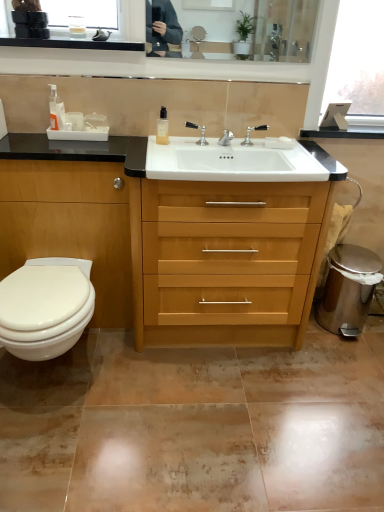
This screenshot has height=512, width=384. Find the location of `polished silver faucet at center`. polished silver faucet at center is located at coordinates (201, 132).

This screenshot has height=512, width=384. What do you see at coordinates (226, 261) in the screenshot? I see `light wood/finish chest of drawers at center` at bounding box center [226, 261].

Where is `clear glass bottle at center, placed as the second toiletry when sorted from left to right`? This screenshot has height=512, width=384. clear glass bottle at center, placed as the second toiletry when sorted from left to right is located at coordinates (162, 127).

How many degrees apart are the facing directions of white glossy toilet at lower left and light wood/finish chest of drawers at center?

The facing directions of white glossy toilet at lower left and light wood/finish chest of drawers at center are 0.343 degrees apart.

From the image's perspective, is white glossy toilet at lower left above or below light wood/finish chest of drawers at center?

Clearly, from the image's perspective, white glossy toilet at lower left is below light wood/finish chest of drawers at center.

Which of these two, white glossy toilet at lower left or light wood/finish chest of drawers at center, is bigger?

light wood/finish chest of drawers at center is bigger.

Find the location of a particular element. The height and width of the screenshot is (512, 384). the chest of drawers behind the white glossy toilet at lower left is located at coordinates (226, 261).

Is translucent plastic bottle at upper left, marked as the first toiletry in a left-to-right arrangement, bigger than polished chrome faucet at center?

Correct, translucent plastic bottle at upper left, marked as the first toiletry in a left-to-right arrangement, is larger in size than polished chrome faucet at center.

From the image's perspective, does translucent plastic bottle at upper left, marked as the first toiletry in a left-to-right arrangement, appear higher than polished chrome faucet at center?

Correct, translucent plastic bottle at upper left, marked as the first toiletry in a left-to-right arrangement, appears higher than polished chrome faucet at center in the image.

Based on the photo, considering the positions of objects translucent plastic bottle at upper left, acting as the second toiletry starting from the right, and polished chrome faucet at center in the image provided, who is more to the left, translucent plastic bottle at upper left, acting as the second toiletry starting from the right, or polished chrome faucet at center?

Positioned to the left is translucent plastic bottle at upper left, acting as the second toiletry starting from the right.

From a real-world perspective, which is physically below, translucent plastic bottle at upper left, marked as the first toiletry in a left-to-right arrangement, or polished chrome faucet at center?

In real-world perspective, polished chrome faucet at center is lower.

Consider the image. Which object is positioned more to the right, polished silver faucet at center or translucent plastic bottle at upper left, acting as the second toiletry starting from the right?

polished silver faucet at center.

The width and height of the screenshot is (384, 512). I want to click on faucet to the right of translucent plastic bottle at upper left, marked as the first toiletry in a left-to-right arrangement, so click(x=201, y=132).

Who is smaller, polished silver faucet at center or translucent plastic bottle at upper left, marked as the first toiletry in a left-to-right arrangement?

polished silver faucet at center.

From a real-world perspective, does polished silver faucet at center sit lower than translucent plastic bottle at upper left, marked as the first toiletry in a left-to-right arrangement?

Indeed, from a real-world perspective, polished silver faucet at center is positioned beneath translucent plastic bottle at upper left, marked as the first toiletry in a left-to-right arrangement.

Is polished silver faucet at center outside of clear glass bottle at center, positioned as the 1th toiletry in right-to-left order?

Absolutely, polished silver faucet at center is external to clear glass bottle at center, positioned as the 1th toiletry in right-to-left order.

Is polished silver faucet at center positioned with its back to clear glass bottle at center, positioned as the 1th toiletry in right-to-left order?

polished silver faucet at center does not have its back to clear glass bottle at center, positioned as the 1th toiletry in right-to-left order.

Consider the image. From a real-world perspective, between polished silver faucet at center and clear glass bottle at center, positioned as the 1th toiletry in right-to-left order, who is vertically higher?

From a 3D spatial view, clear glass bottle at center, positioned as the 1th toiletry in right-to-left order, is above.

Does polished silver faucet at center appear on the right side of clear glass bottle at center, placed as the second toiletry when sorted from left to right?

Yes, polished silver faucet at center is to the right of clear glass bottle at center, placed as the second toiletry when sorted from left to right.

Is polished silver faucet at center wider than light wood/finish chest of drawers at center?

Incorrect, the width of polished silver faucet at center does not surpass that of light wood/finish chest of drawers at center.

From the image's perspective, which is above, polished silver faucet at center or light wood/finish chest of drawers at center?

polished silver faucet at center.

Could you tell me if polished silver faucet at center is turned towards light wood/finish chest of drawers at center?

No, polished silver faucet at center is not turned towards light wood/finish chest of drawers at center.

From a real-world perspective, which object rests below the other?

light wood/finish chest of drawers at center.

Considering the positions of objects polished silver faucet at center and white glossy toilet at lower left in the image provided, who is more to the left, polished silver faucet at center or white glossy toilet at lower left?

white glossy toilet at lower left.

Is polished silver faucet at center placed right next to white glossy toilet at lower left?

No, polished silver faucet at center is not beside white glossy toilet at lower left.

Looking at their sizes, would you say polished silver faucet at center is wider or thinner than white glossy toilet at lower left?

Clearly, polished silver faucet at center has less width compared to white glossy toilet at lower left.

From a real-world perspective, between polished silver faucet at center and white glossy toilet at lower left, who is vertically higher?

polished silver faucet at center is physically above.

From the image's perspective, who appears lower, polished chrome faucet at center or clear glass bottle at center, placed as the second toiletry when sorted from left to right?

polished chrome faucet at center, from the image's perspective.

From a real-world perspective, is polished chrome faucet at center physically located above or below clear glass bottle at center, placed as the second toiletry when sorted from left to right?

Clearly, from a real-world perspective, polished chrome faucet at center is below clear glass bottle at center, placed as the second toiletry when sorted from left to right.

Considering the relative sizes of polished chrome faucet at center and clear glass bottle at center, positioned as the 1th toiletry in right-to-left order, in the image provided, is polished chrome faucet at center shorter than clear glass bottle at center, positioned as the 1th toiletry in right-to-left order,?

Indeed, polished chrome faucet at center has a lesser height compared to clear glass bottle at center, positioned as the 1th toiletry in right-to-left order.

Where is `the chest of drawers that appears above the white glossy toilet at lower left (from the image's perspective)`? The width and height of the screenshot is (384, 512). the chest of drawers that appears above the white glossy toilet at lower left (from the image's perspective) is located at coordinates (226, 261).

Image resolution: width=384 pixels, height=512 pixels. I want to click on tap directly beneath the translucent plastic bottle at upper left, acting as the second toiletry starting from the right (from a real-world perspective), so click(250, 132).

Looking at the image, which one is located closer to polished silver faucet at center, polished chrome faucet at center or translucent plastic bottle at upper left, acting as the second toiletry starting from the right?

The object closer to polished silver faucet at center is polished chrome faucet at center.

When comparing their distances from white glossy toilet at lower left, does polished silver faucet at center or clear glass bottle at center, placed as the second toiletry when sorted from left to right, seem closer?

clear glass bottle at center, placed as the second toiletry when sorted from left to right, is closer to white glossy toilet at lower left.

Which object lies further to the anchor point translucent plastic bottle at upper left, marked as the first toiletry in a left-to-right arrangement, polished chrome faucet at center or polished silver faucet at center?

Based on the image, polished chrome faucet at center appears to be further to translucent plastic bottle at upper left, marked as the first toiletry in a left-to-right arrangement.

From the image, which object appears to be farther from polished chrome faucet at center, translucent plastic bottle at upper left, marked as the first toiletry in a left-to-right arrangement, or clear glass bottle at center, placed as the second toiletry when sorted from left to right?

translucent plastic bottle at upper left, marked as the first toiletry in a left-to-right arrangement, lies further to polished chrome faucet at center than the other object.

Estimate the real-world distances between objects in this image. Which object is further from clear glass bottle at center, placed as the second toiletry when sorted from left to right, translucent plastic bottle at upper left, marked as the first toiletry in a left-to-right arrangement, or polished silver faucet at center?

translucent plastic bottle at upper left, marked as the first toiletry in a left-to-right arrangement, is further to clear glass bottle at center, placed as the second toiletry when sorted from left to right.

Based on their spatial positions, is translucent plastic bottle at upper left, acting as the second toiletry starting from the right, or white glossy toilet at lower left closer to clear glass bottle at center, placed as the second toiletry when sorted from left to right?

Based on the image, translucent plastic bottle at upper left, acting as the second toiletry starting from the right, appears to be nearer to clear glass bottle at center, placed as the second toiletry when sorted from left to right.

Which object lies further to the anchor point white glossy toilet at lower left, light wood/finish chest of drawers at center or polished chrome faucet at center?

Based on the image, polished chrome faucet at center appears to be further to white glossy toilet at lower left.

Considering their positions, is clear glass bottle at center, placed as the second toiletry when sorted from left to right, positioned further to translucent plastic bottle at upper left, marked as the first toiletry in a left-to-right arrangement, than polished silver faucet at center?

The object further to translucent plastic bottle at upper left, marked as the first toiletry in a left-to-right arrangement, is polished silver faucet at center.

You are a GUI agent. You are given a task and a screenshot of the screen. Output one action in this format:
    pyautogui.click(x=<x>, y=<y>)
    Task: Click on the toiletry between translucent plastic bottle at upper left, marked as the first toiletry in a left-to-right arrangement, and white glossy toilet at lower left vertically
    
    Given the screenshot: What is the action you would take?
    pyautogui.click(x=162, y=127)

The height and width of the screenshot is (512, 384). What are the coordinates of `tap between polished silver faucet at center and light wood/finish chest of drawers at center in the up-down direction` in the screenshot? It's located at (250, 132).

Locate an element on the screen. faucet between translucent plastic bottle at upper left, acting as the second toiletry starting from the right, and light wood/finish chest of drawers at center is located at coordinates (201, 132).

Where is `toiletry between translucent plastic bottle at upper left, marked as the first toiletry in a left-to-right arrangement, and light wood/finish chest of drawers at center`? The width and height of the screenshot is (384, 512). toiletry between translucent plastic bottle at upper left, marked as the first toiletry in a left-to-right arrangement, and light wood/finish chest of drawers at center is located at coordinates (162, 127).